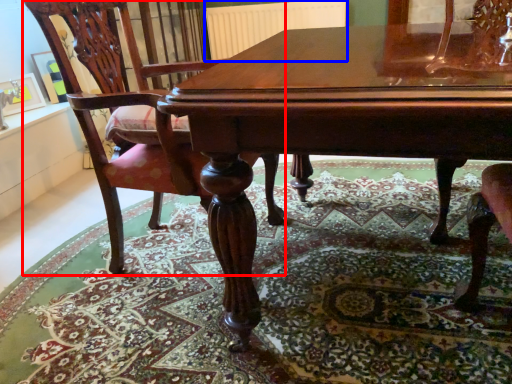
Question: Which object appears farthest to the camera in this image, chair (highlighted by a red box) or radiator (highlighted by a blue box)?

Choices:
 (A) chair
 (B) radiator

Answer: (B)